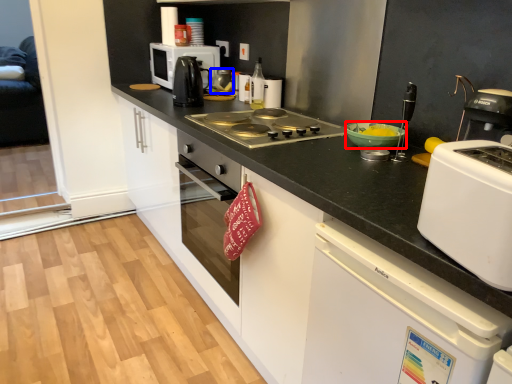
Question: Which point is further to the camera, bowl (highlighted by a red box) or kitchen appliance (highlighted by a blue box)?

Choices:
 (A) bowl
 (B) kitchen appliance

Answer: (B)